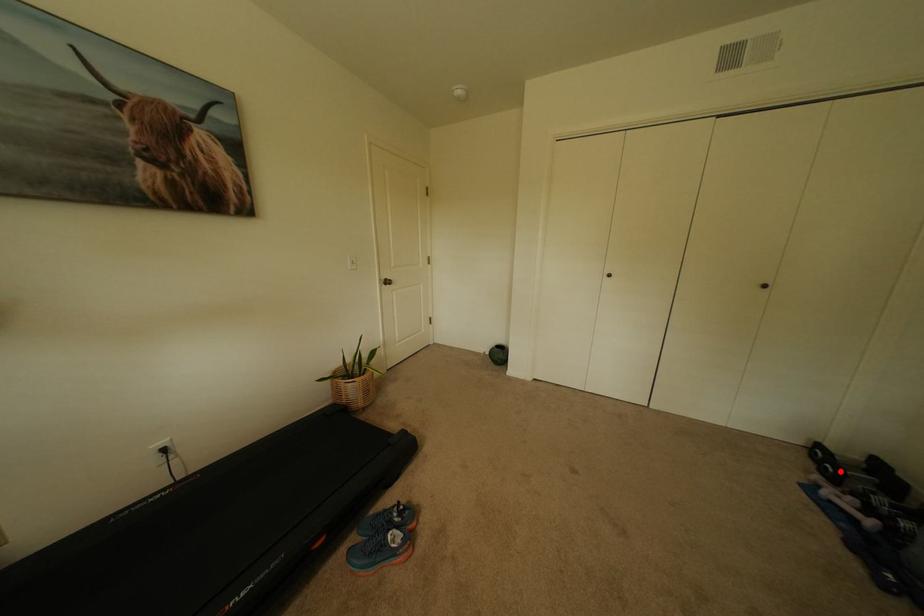
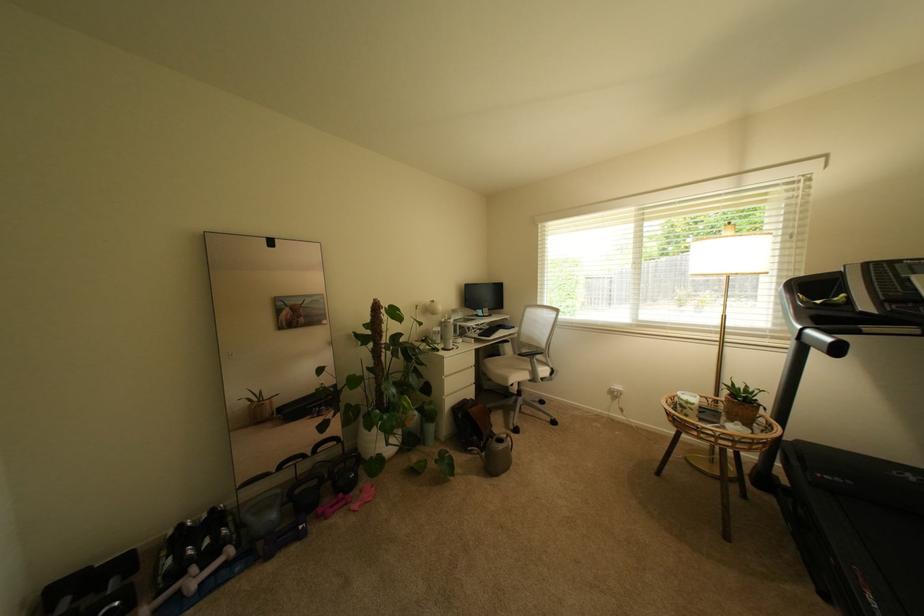
The point at the highlighted location is marked in the first image. Where is the corresponding point in the second image?

(126, 604)